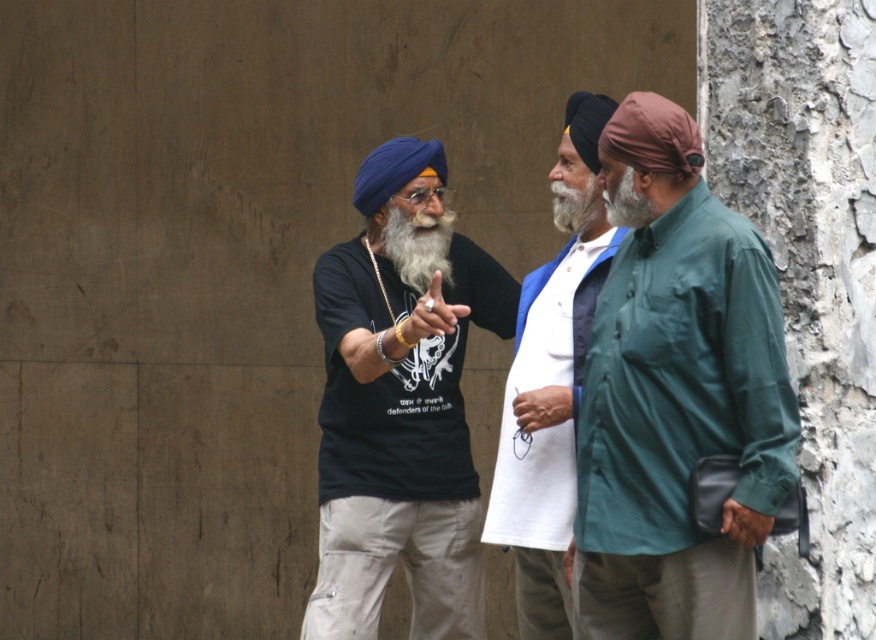
Question: Can you confirm if green fabric shirt at right is bigger than white cotton shirt at center?

Choices:
 (A) no
 (B) yes

Answer: (B)

Question: Can you confirm if green fabric shirt at right is positioned above white cotton shirt at center?

Choices:
 (A) yes
 (B) no

Answer: (B)

Question: Among these objects, which one is farthest from the camera?

Choices:
 (A) green fabric shirt at right
 (B) white matte beard at center
 (C) white cotton shirt at center

Answer: (B)

Question: Which of the following is the farthest from the observer?

Choices:
 (A) white matte beard at center
 (B) matte black t-shirt at center

Answer: (A)

Question: Where is matte black t-shirt at center located in relation to white cotton shirt at center in the image?

Choices:
 (A) below
 (B) above

Answer: (A)

Question: Which point is farther to the camera?

Choices:
 (A) click(661, 481)
 (B) click(428, 280)
 (C) click(343, 483)

Answer: (B)